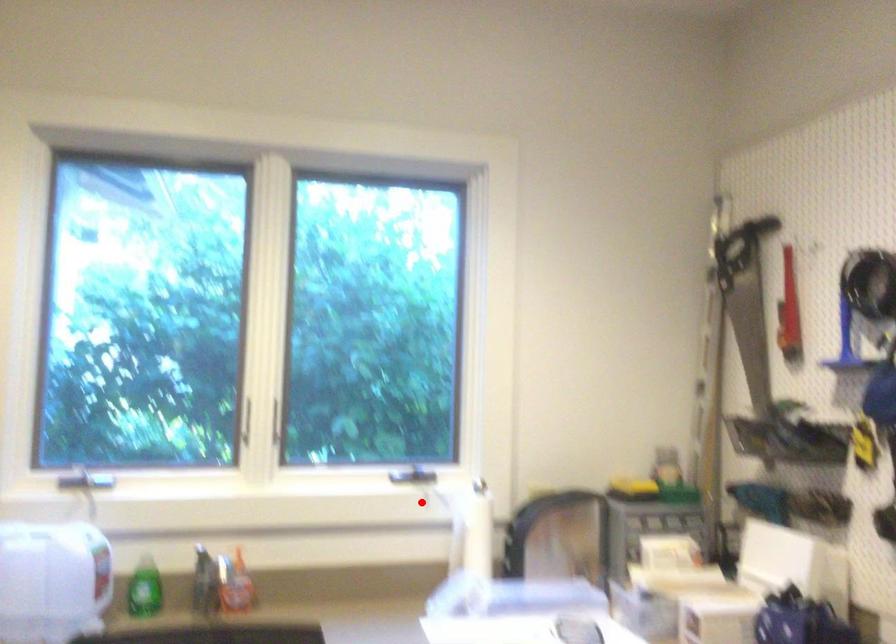
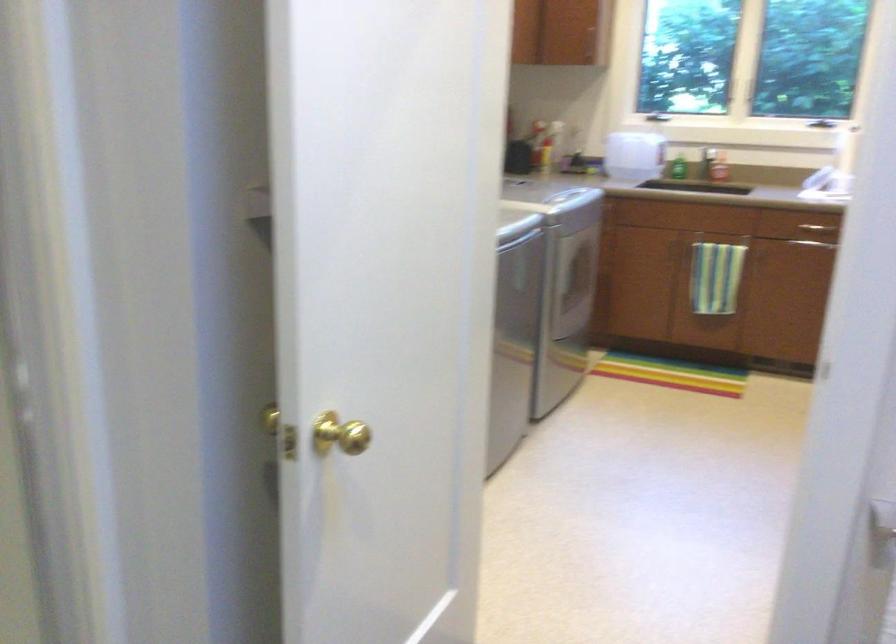
Question: A red point is marked in image1. In image2, is the corresponding 3D point closer to the camera or farther? Reply with the corresponding letter.

Choices:
 (A) The corresponding 3D point is closer.
 (B) The corresponding 3D point is farther.

Answer: (B)